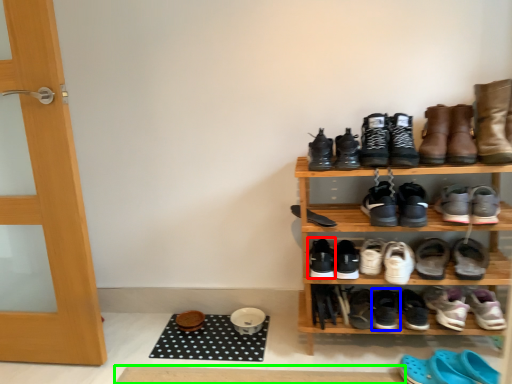
Question: Which is farther away from footwear (highlighted by a red box)? footwear (highlighted by a blue box) or doormat (highlighted by a green box)?

Choices:
 (A) footwear
 (B) doormat

Answer: (B)